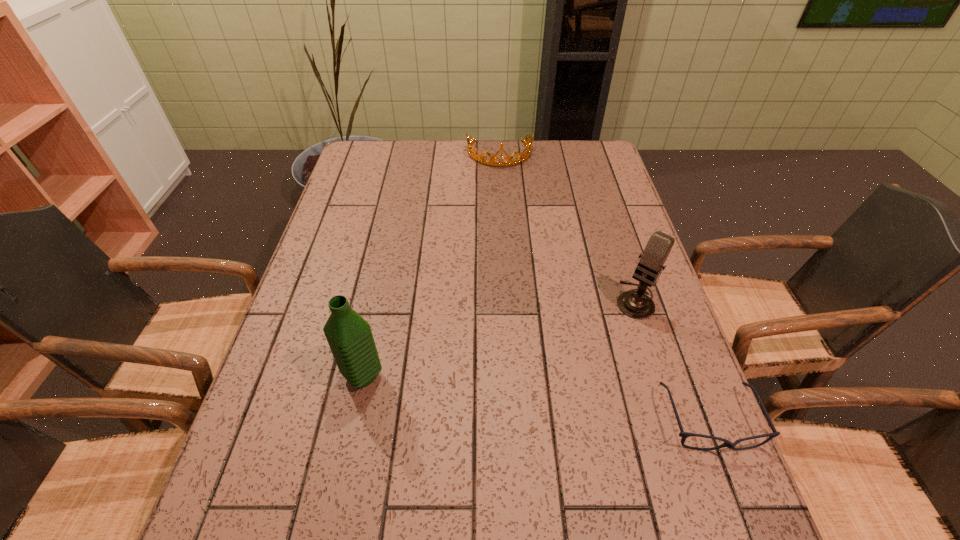
This screenshot has height=540, width=960. In order to click on free space on the desktop that is between the water bottle and the shortest object and is positioned on the front-facing side of the third tallest object in this screenshot , I will do `click(520, 396)`.

Locate an element on the screen. vacant spot on the desktop that is between the leftmost object and the spectacles and is positioned on the front-facing side of the microphone is located at coordinates (549, 400).